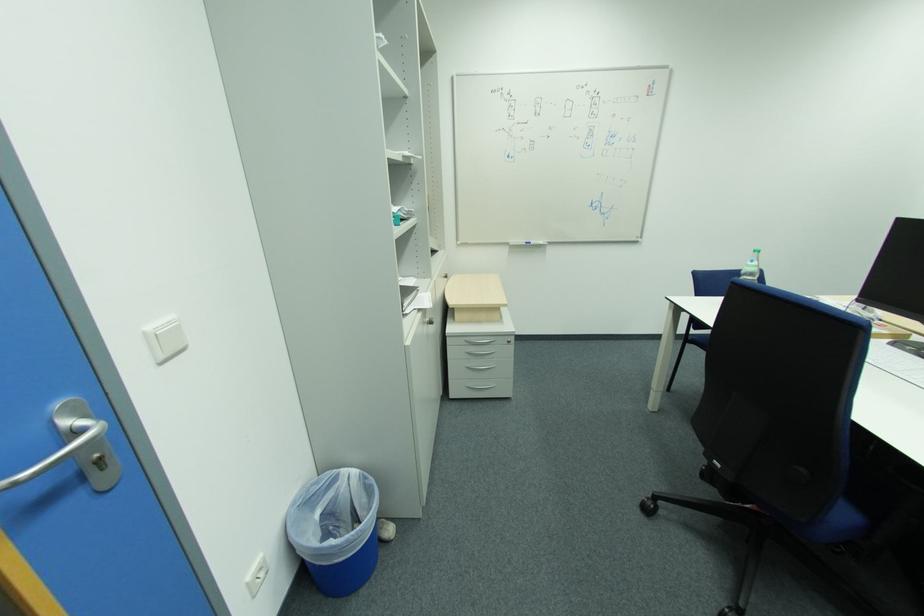
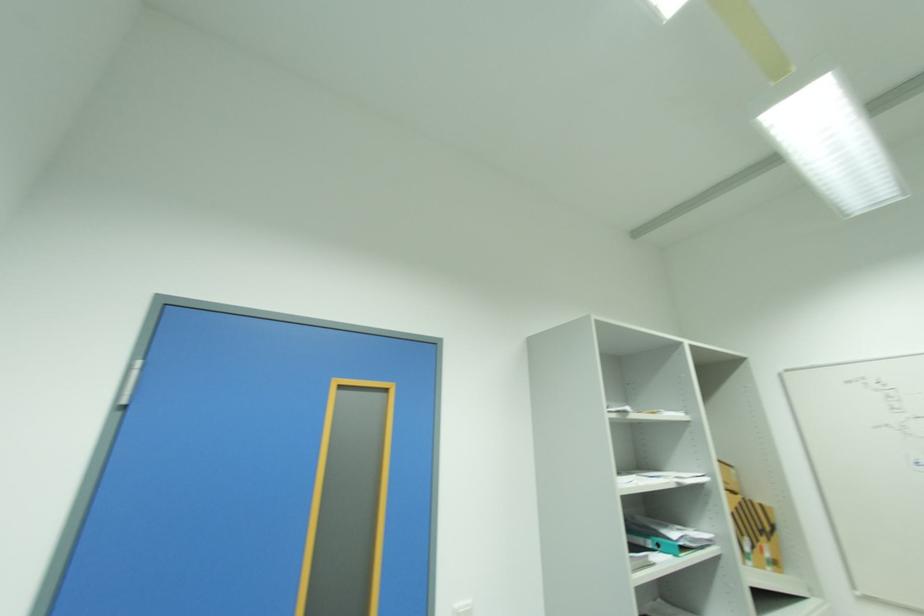
Find the pixel in the second image that matches (x=154, y=329) in the first image.

(463, 604)